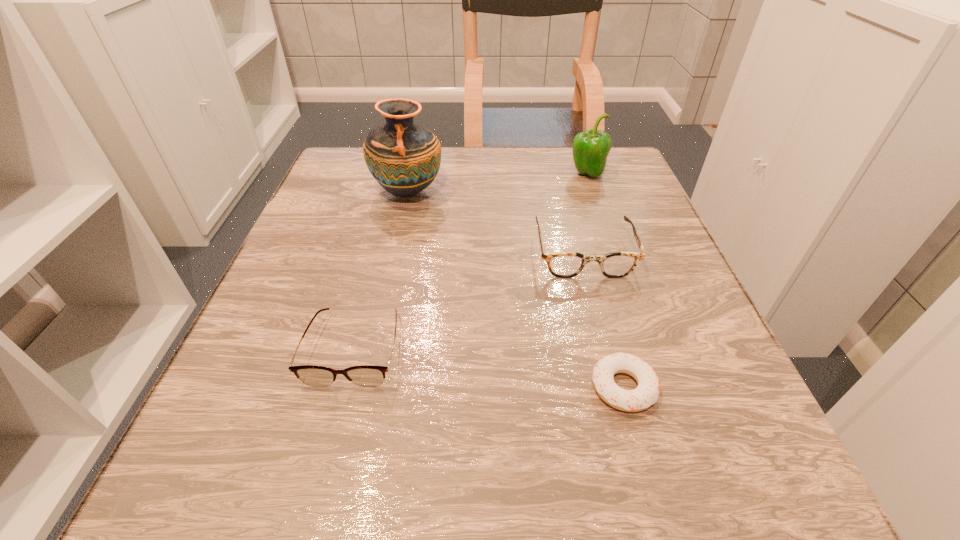
Identify the location of vacant space that satisfies the following two spatial constraints: 1. on the frame of the third tallest object; 2. on the left side of the doughnut. (619, 387).

The width and height of the screenshot is (960, 540). Find the location of `free location that satisfies the following two spatial constraints: 1. on the frame of the shortest object; 2. on the left side of the right spectacles`. free location that satisfies the following two spatial constraints: 1. on the frame of the shortest object; 2. on the left side of the right spectacles is located at coordinates (619, 387).

Image resolution: width=960 pixels, height=540 pixels. I want to click on free space in the image that satisfies the following two spatial constraints: 1. on the face of the shortest object; 2. on the left side of the fourth tallest object, so click(345, 387).

Image resolution: width=960 pixels, height=540 pixels. Find the location of `free space that satisfies the following two spatial constraints: 1. on the back side of the pottery; 2. on the left side of the fourth shortest object`. free space that satisfies the following two spatial constraints: 1. on the back side of the pottery; 2. on the left side of the fourth shortest object is located at coordinates (412, 174).